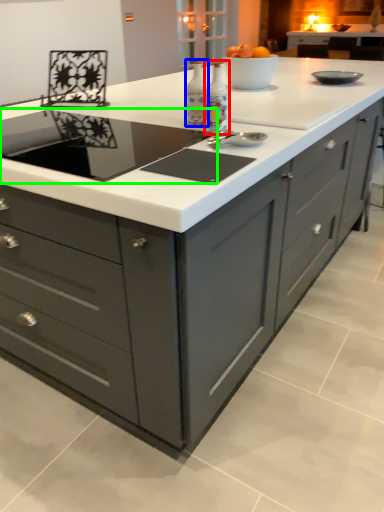
Question: Which is nearer to the appliance (highlighted by a red box)? appliance (highlighted by a blue box) or home appliance (highlighted by a green box).

Choices:
 (A) appliance
 (B) home appliance

Answer: (A)